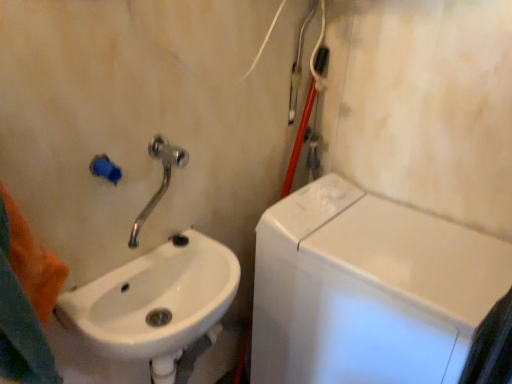
Question: Does silver metallic faucet at upper left touch white glossy washing machine at right?

Choices:
 (A) yes
 (B) no

Answer: (B)

Question: From the image's perspective, would you say silver metallic faucet at upper left is positioned over white glossy washing machine at right?

Choices:
 (A) no
 (B) yes

Answer: (B)

Question: Does silver metallic faucet at upper left appear on the left side of white glossy washing machine at right?

Choices:
 (A) no
 (B) yes

Answer: (B)

Question: Is silver metallic faucet at upper left surrounding white glossy washing machine at right?

Choices:
 (A) no
 (B) yes

Answer: (A)

Question: Is silver metallic faucet at upper left oriented towards white glossy washing machine at right?

Choices:
 (A) no
 (B) yes

Answer: (A)

Question: Is silver metallic faucet at upper left taller than white glossy washing machine at right?

Choices:
 (A) yes
 (B) no

Answer: (B)

Question: From a real-world perspective, does white glossy sink at lower left sit lower than white glossy washing machine at right?

Choices:
 (A) yes
 (B) no

Answer: (B)

Question: From the image's perspective, does white glossy sink at lower left appear higher than white glossy washing machine at right?

Choices:
 (A) yes
 (B) no

Answer: (A)

Question: Is the depth of white glossy sink at lower left greater than that of white glossy washing machine at right?

Choices:
 (A) no
 (B) yes

Answer: (A)

Question: Is white glossy sink at lower left looking in the opposite direction of white glossy washing machine at right?

Choices:
 (A) no
 (B) yes

Answer: (A)

Question: Is white glossy sink at lower left outside of white glossy washing machine at right?

Choices:
 (A) no
 (B) yes

Answer: (B)

Question: Could you tell me if white glossy sink at lower left is turned towards white glossy washing machine at right?

Choices:
 (A) yes
 (B) no

Answer: (B)

Question: Can you confirm if white glossy washing machine at right is smaller than silver metallic faucet at upper left?

Choices:
 (A) yes
 (B) no

Answer: (B)